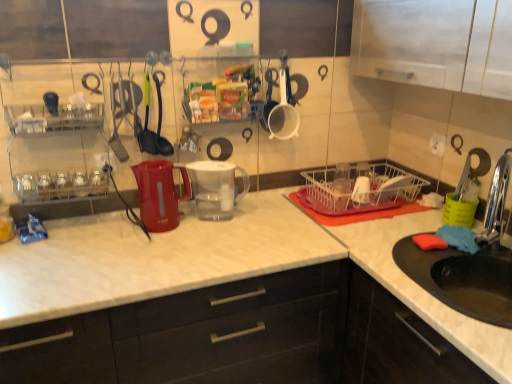
Find the location of a particular element. This screenshot has width=512, height=384. vacant space to the left of white wire basket at center is located at coordinates (276, 213).